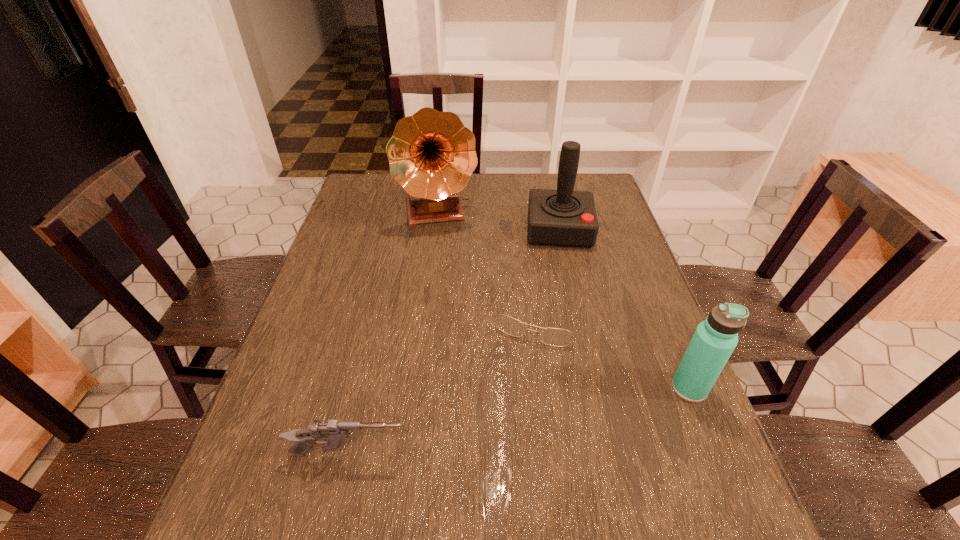
Where is `empty space that is in between the tallest object and the spectacles`? The width and height of the screenshot is (960, 540). empty space that is in between the tallest object and the spectacles is located at coordinates (490, 264).

At what (x,y) coordinates should I click in order to perform the action: click on empty location between the third nearest object and the phonograph_record. Please return your answer as a coordinate pair (x, y). This screenshot has width=960, height=540. Looking at the image, I should click on (490, 264).

I want to click on vacant area that lies between the thermos bottle and the joystick, so click(x=624, y=309).

Locate an element on the screen. free spot between the second shortest object and the second nearest object is located at coordinates (519, 421).

Image resolution: width=960 pixels, height=540 pixels. I want to click on blank region between the phonograph_record and the spectacles, so click(x=490, y=264).

Identify the location of vacant area between the rightmost object and the joystick. The width and height of the screenshot is (960, 540). click(624, 309).

You are a GUI agent. You are given a task and a screenshot of the screen. Output one action in this format:
    pyautogui.click(x=<x>, y=<y>)
    Task: Click on the free space between the fourth tallest object and the phonograph_record
    
    Given the screenshot: What is the action you would take?
    pyautogui.click(x=395, y=333)

Identify the location of free space between the second shortest object and the joystick. Image resolution: width=960 pixels, height=540 pixels. (454, 342).

Image resolution: width=960 pixels, height=540 pixels. Identify the location of vacant area that lies between the joystick and the spectacles. (550, 272).

This screenshot has height=540, width=960. Identify the location of blank region between the second nearest object and the nearest object. (519, 421).